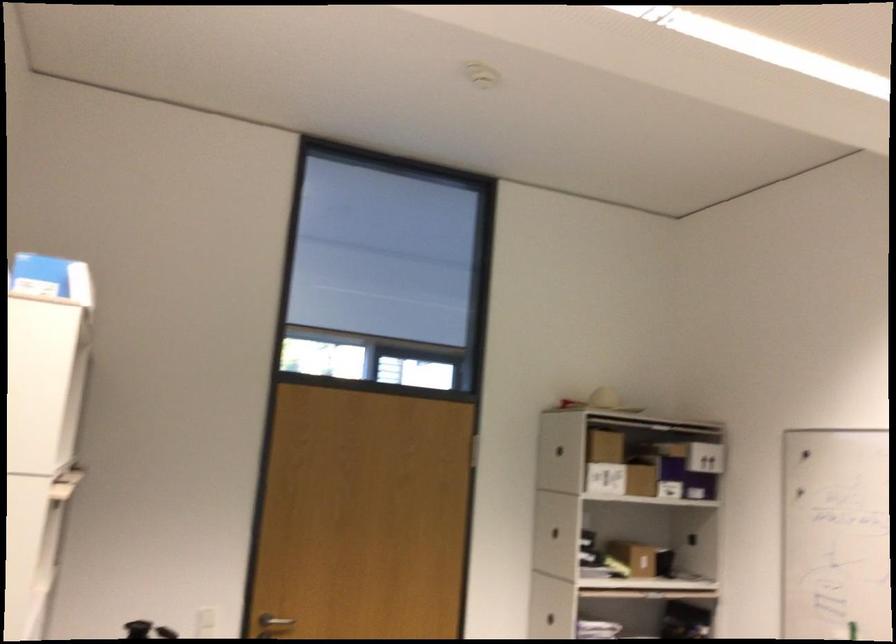
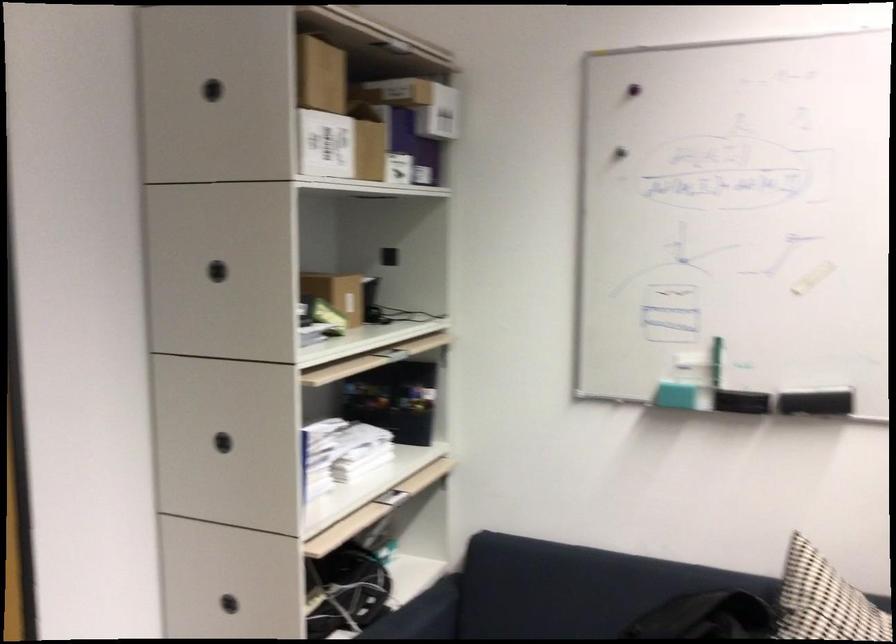
The point at [675,489] is marked in the first image. Where is the corresponding point in the second image?

(398, 167)